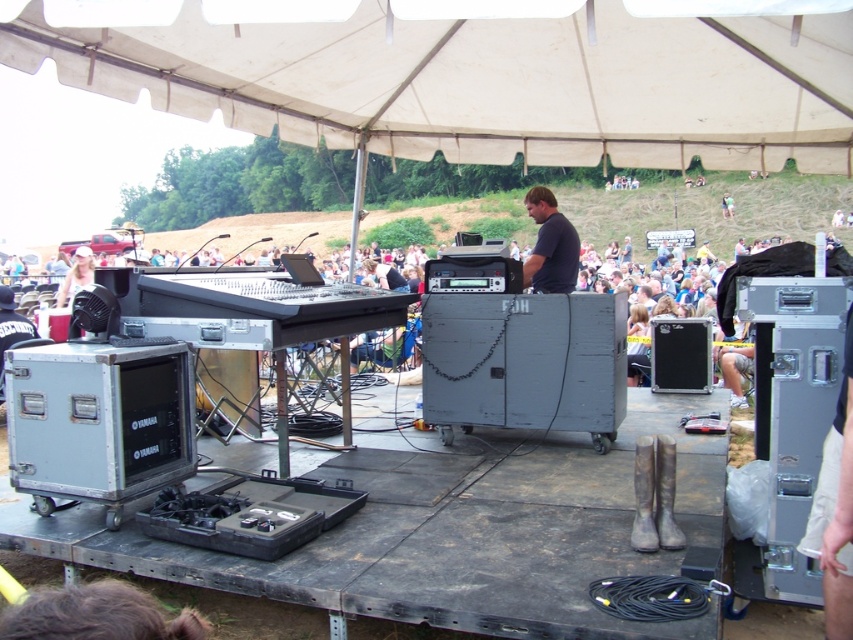
Question: Estimate the real-world distances between objects in this image. Which object is farther from the matte white baseball cap at upper left?

Choices:
 (A) white fabric canopy at upper center
 (B) dark gray shirt at center

Answer: (B)

Question: Which of the following is the closest to the observer?

Choices:
 (A) dark gray shirt at center
 (B) white fabric canopy at upper center

Answer: (B)

Question: Does white fabric canopy at upper center appear over dark gray shirt at center?

Choices:
 (A) yes
 (B) no

Answer: (A)

Question: Observing the image, what is the correct spatial positioning of dark gray shirt at center in reference to matte white baseball cap at upper left?

Choices:
 (A) below
 (B) above

Answer: (A)

Question: Which point is farther from the camera taking this photo?

Choices:
 (A) (347, 48)
 (B) (85, 262)

Answer: (B)

Question: Can you confirm if dark gray shirt at center is positioned to the right of matte white baseball cap at upper left?

Choices:
 (A) yes
 (B) no

Answer: (A)